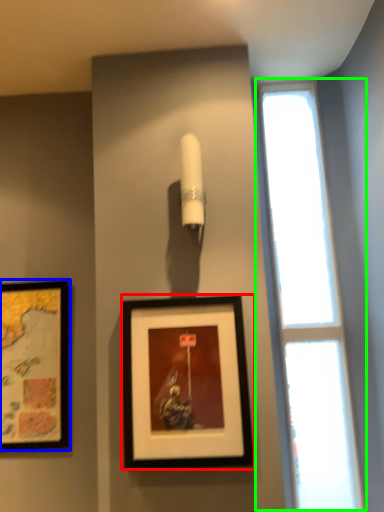
Question: Which object is the closest to the picture frame (highlighted by a red box)? Choose among these: picture frame (highlighted by a blue box) or window (highlighted by a green box).

Choices:
 (A) picture frame
 (B) window

Answer: (B)